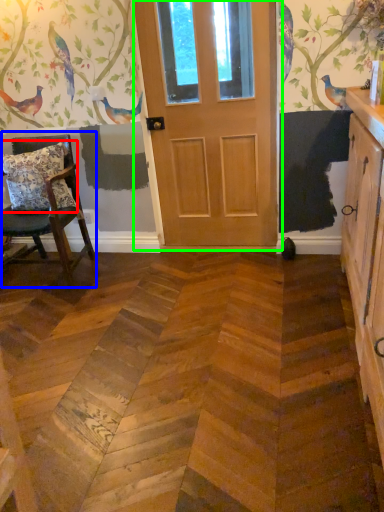
Question: Estimate the real-world distances between objects in this image. Which object is farther from pillow (highlighted by a red box), chair (highlighted by a blue box) or door (highlighted by a green box)?

Choices:
 (A) chair
 (B) door

Answer: (B)